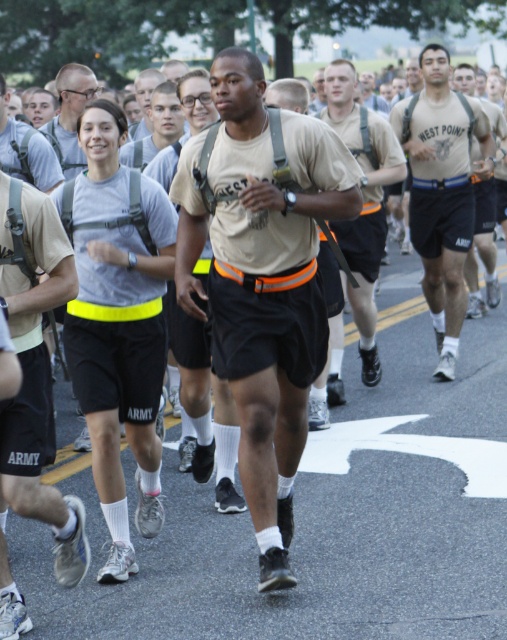
You are a photographer positioned at the starting line of the event. You want to take a photo that includes both the tan matte uniform at center and the matte gray shirt at upper center. The camera can capture a maximum distance of 3 meters between the closest and farthest subjects. Will you be able to include both in the photo?

The tan matte uniform at center is 3.56 meters from the matte gray shirt at upper center. Since the camera can only capture up to 3 meters between subjects, the distance is too great. You won not be able to include both in the photo.

You are a photographer positioned at the back of the group. You want to take a photo of the tan uniform at center without the tan matte uniform at center blocking it. Is this possible?

The tan matte uniform at center is in front of the tan uniform at center, so the tan uniform at center is blocked by the tan matte uniform at center. Therefore, it is not possible to take a photo of the tan uniform at center without the tan matte uniform at center blocking it.